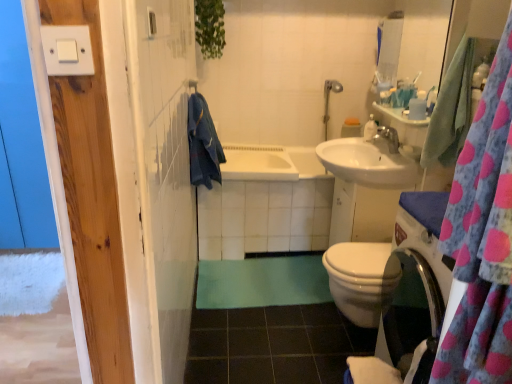
Question: In the image, is silver metallic faucet at upper center positioned in front of or behind green rubber mat at lower center?

Choices:
 (A) behind
 (B) front

Answer: (A)

Question: In terms of width, does silver metallic faucet at upper center look wider or thinner when compared to green rubber mat at lower center?

Choices:
 (A) wide
 (B) thin

Answer: (B)

Question: Considering the real-world distances, which object is farthest from the green fabric bath mat at center?

Choices:
 (A) white plastic light switch at upper left
 (B) glossy ceramic mirror at upper right
 (C) silver metallic faucet at upper center
 (D) pink polka dot fabric at right
 (E) white glossy sink at center right

Answer: (A)

Question: Which is farther from the white glossy sink at center right?

Choices:
 (A) silver metallic shower head at upper right
 (B) green rubber mat at lower center
 (C) teal fabric towel at upper right, which is the 2th bath towel in back-to-front order
 (D) white ceramic bathtub at center, which ranks as the first bath in bottom-to-top order
 (E) white plastic light switch at upper left

Answer: (E)